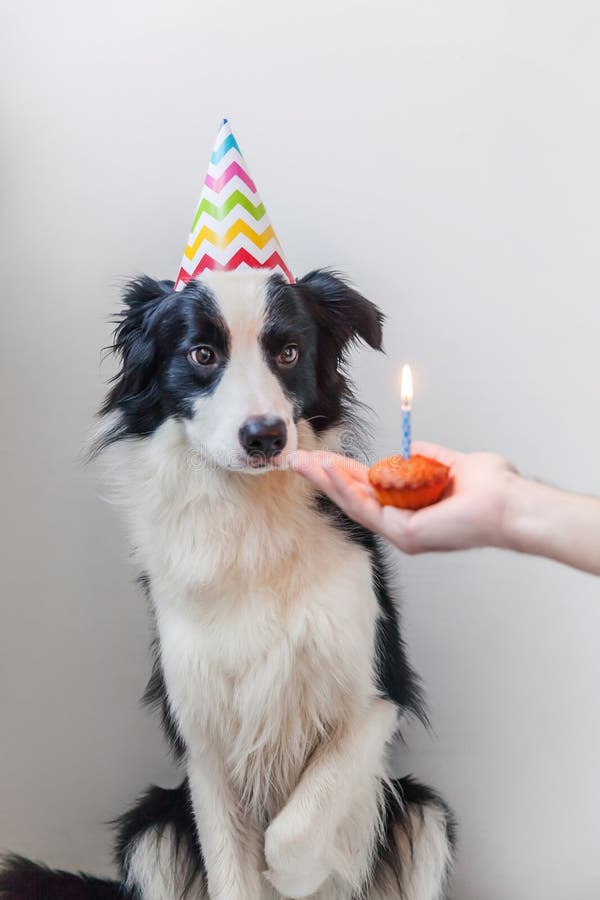
Where is `white background wall`? This screenshot has width=600, height=900. white background wall is located at coordinates (540, 603).